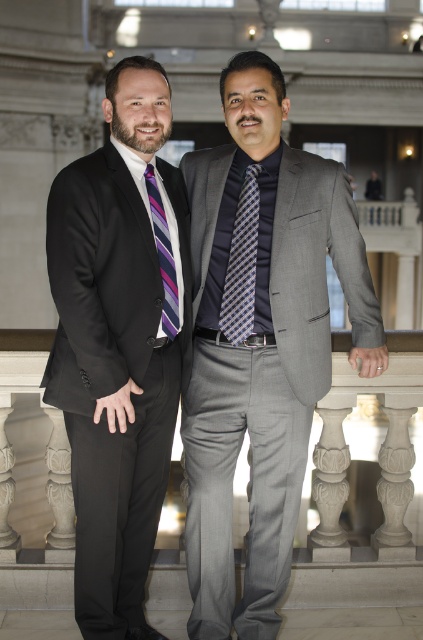
Can you confirm if matte black suit at left is positioned to the right of purple striped tie at left?

Incorrect, matte black suit at left is not on the right side of purple striped tie at left.

Is the position of matte black suit at left less distant than that of purple striped tie at left?

That is True.

Is point (145, 323) in front of point (151, 212)?

Yes, point (145, 323) is in front of point (151, 212).

Where is `matte black suit at left`? This screenshot has height=640, width=423. matte black suit at left is located at coordinates (120, 342).

Between matte black suit at left and plaid silk tie at center, which one has less height?

With less height is plaid silk tie at center.

Does matte black suit at left come in front of plaid silk tie at center?

Yes, matte black suit at left is closer to the viewer.

Between point (84, 637) and point (233, 332), which one is positioned in front?

Point (84, 637)

You are a GUI agent. You are given a task and a screenshot of the screen. Output one action in this format:
    pyautogui.click(x=<x>, y=<y>)
    Task: Click on the matte black suit at left
    Image resolution: width=423 pixels, height=640 pixels.
    Given the screenshot: What is the action you would take?
    pyautogui.click(x=120, y=342)

Between plaid silk tie at center and purple striped tie at left, which one appears on the right side from the viewer's perspective?

plaid silk tie at center

Can you confirm if plaid silk tie at center is shorter than purple striped tie at left?

No.

What do you see at coordinates (241, 262) in the screenshot? I see `plaid silk tie at center` at bounding box center [241, 262].

The height and width of the screenshot is (640, 423). Find the location of `plaid silk tie at center`. plaid silk tie at center is located at coordinates (241, 262).